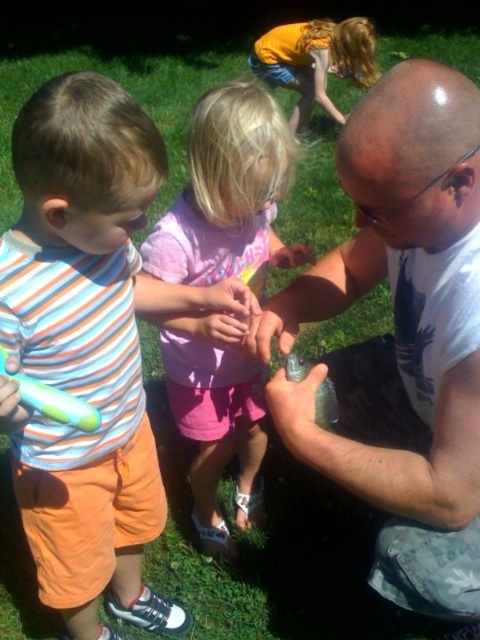
Is satin white shirt at center taller than striped cotton shirt at center?

In fact, satin white shirt at center may be shorter than striped cotton shirt at center.

Between point (465, 81) and point (59, 262), which one is positioned behind?

The point (59, 262) is behind.

Does point (255, 333) lie in front of point (146, 452)?

Yes, point (255, 333) is closer to viewer.

This screenshot has height=640, width=480. In order to click on satin white shirt at center in this screenshot , I will do `click(402, 337)`.

Between striped cotton shirt at center and pink fabric dress at center, which one has less height?

pink fabric dress at center is shorter.

Between striped cotton shirt at center and pink fabric dress at center, which one is positioned lower?

striped cotton shirt at center

Image resolution: width=480 pixels, height=640 pixels. What do you see at coordinates (88, 348) in the screenshot? I see `striped cotton shirt at center` at bounding box center [88, 348].

At what (x,y) coordinates should I click in order to perform the action: click on striped cotton shirt at center. Please return your answer as a coordinate pair (x, y). The image size is (480, 640). Looking at the image, I should click on (x=88, y=348).

Between satin white shirt at center and pink fabric dress at center, which one is positioned higher?

satin white shirt at center is above.

Where is `satin white shirt at center`? satin white shirt at center is located at coordinates click(x=402, y=337).

Identify the location of satin white shirt at center. (402, 337).